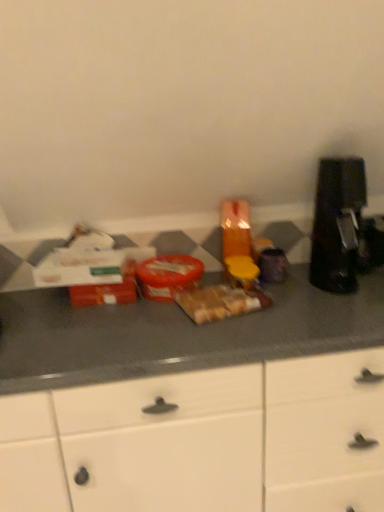
The height and width of the screenshot is (512, 384). Find the location of `vacant region to the right of brown matte sandwich at center, marked as the second food in a left-to-right arrangement`. vacant region to the right of brown matte sandwich at center, marked as the second food in a left-to-right arrangement is located at coordinates point(289,304).